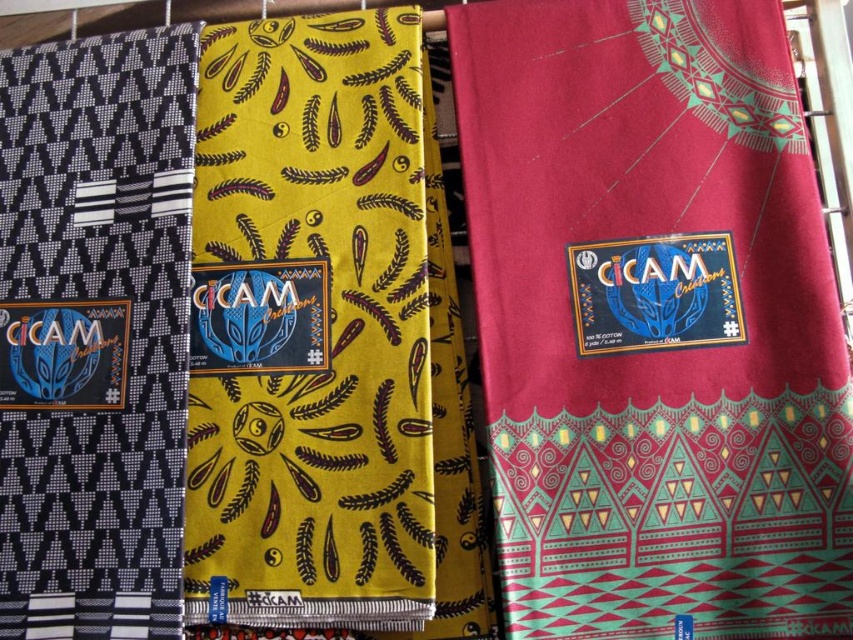
Between point (683, 352) and point (227, 282), which one is positioned behind?

Point (227, 282)

Can you confirm if matte red fabric at center is shorter than yellow cotton fabric at center?

Incorrect, matte red fabric at center's height does not fall short of yellow cotton fabric at center's.

Between point (529, 273) and point (318, 481), which one is positioned behind?

Positioned behind is point (529, 273).

Where is `matte red fabric at center`? This screenshot has height=640, width=853. matte red fabric at center is located at coordinates (653, 321).

Is yellow cotton fabric at center smaller than black woven cloth at left?

Actually, yellow cotton fabric at center might be larger than black woven cloth at left.

Can you confirm if yellow cotton fabric at center is bigger than black woven cloth at left?

Yes.

This screenshot has width=853, height=640. What do you see at coordinates (309, 326) in the screenshot? I see `yellow cotton fabric at center` at bounding box center [309, 326].

Where is `yellow cotton fabric at center`? The width and height of the screenshot is (853, 640). yellow cotton fabric at center is located at coordinates (309, 326).

Is matte red fabric at center bigger than black woven cloth at left?

Yes.

Is point (575, 1) more distant than point (91, 138)?

Yes, point (575, 1) is behind point (91, 138).

Identify the location of matte red fabric at center. The image size is (853, 640). (653, 321).